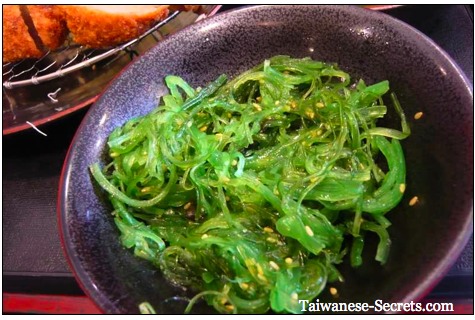
This screenshot has height=320, width=475. What are the coordinates of `metal tray` in the screenshot? It's located at (65, 65), (35, 76).